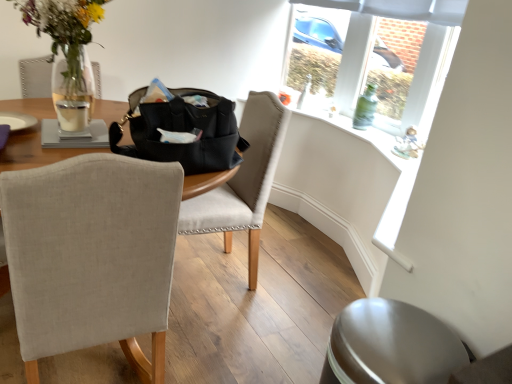
At what (x,y) coordinates should I click in order to perform the action: click on vacant area situated below beige fabric chair at left, the first chair viewed from the front (from a real-world perspective). Please return your answer as a coordinate pair (x, y). Looking at the image, I should click on (92, 364).